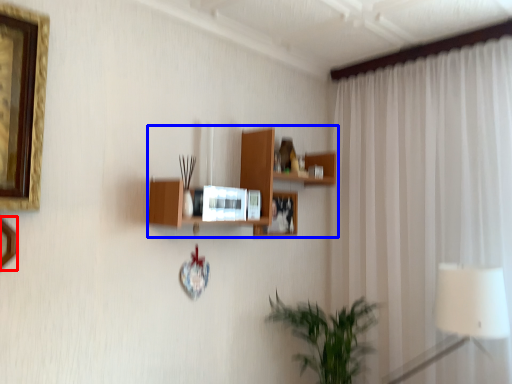
Question: Among these objects, which one is nearest to the camera, picture frame (highlighted by a red box) or shelf (highlighted by a blue box)?

Choices:
 (A) picture frame
 (B) shelf

Answer: (A)